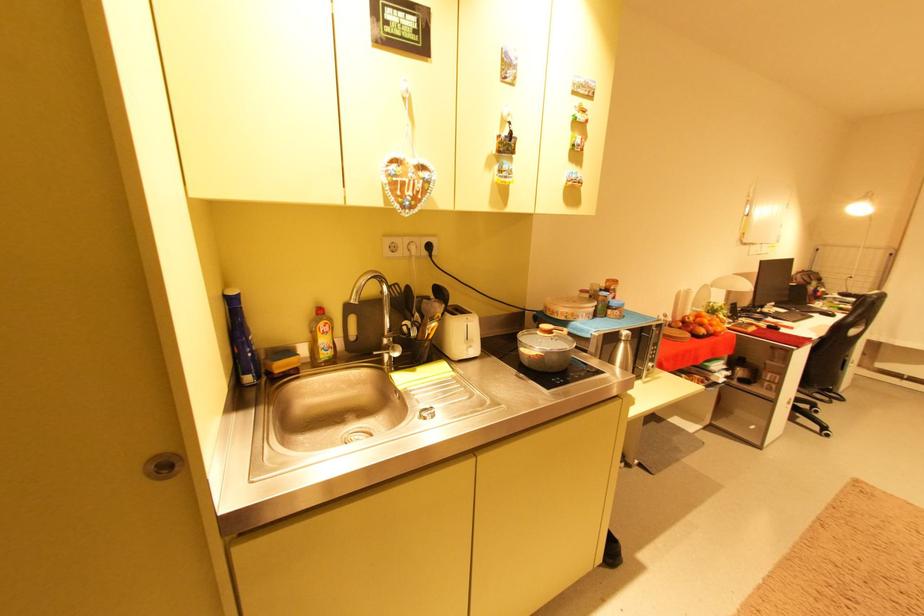
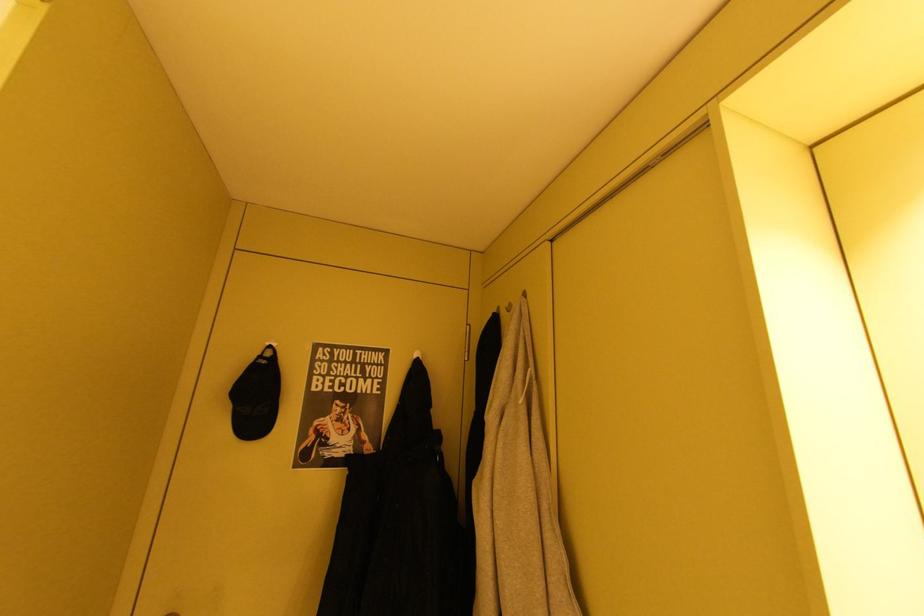
Question: How did the camera likely rotate?

Choices:
 (A) Left
 (B) Right
 (C) Up
 (D) Down

Answer: (A)